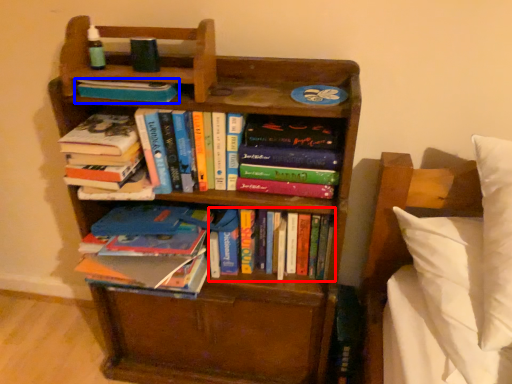
Question: Among these objects, which one is nearest to the camera, book (highlighted by a red box) or book (highlighted by a blue box)?

Choices:
 (A) book
 (B) book

Answer: (B)